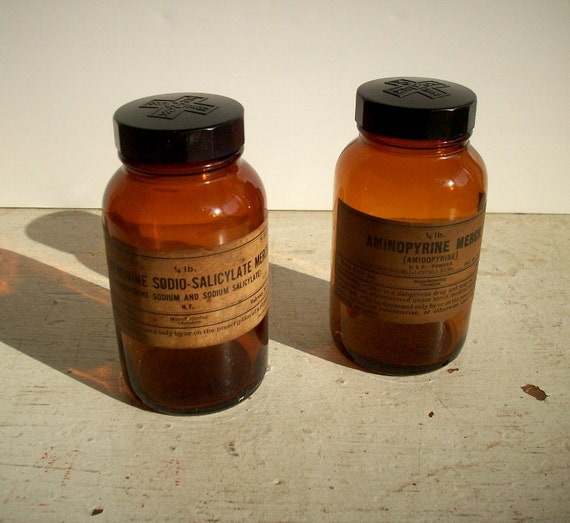
At what (x,y) coordinates should I click in order to perform the action: click on old empty medicine bottle 1. Please return your answer as a coordinate pair (x, y). The height and width of the screenshot is (523, 570). Looking at the image, I should click on (201, 372).